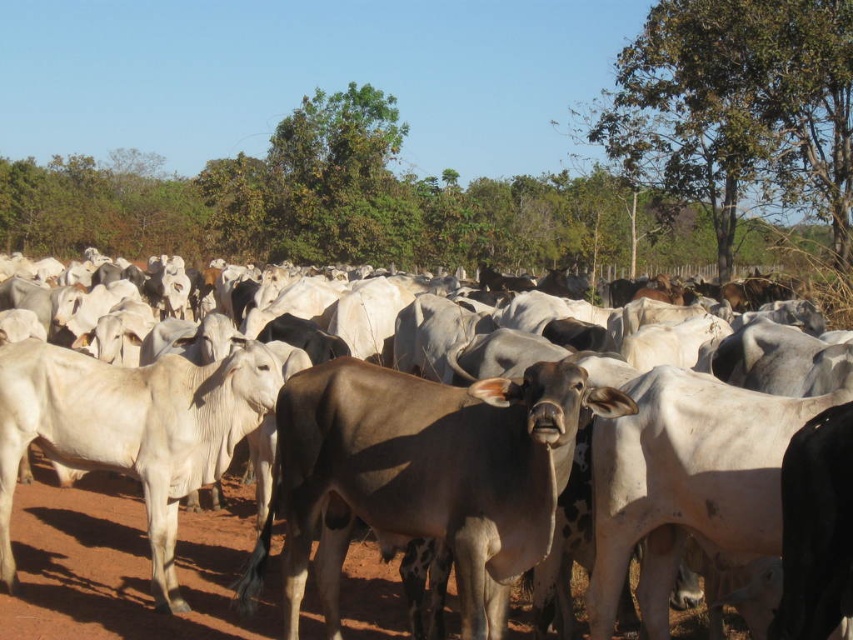
You are a farmer checking the herd and notice the green leafy tree at upper right and the white smooth cows at center. Which object is closer to you?

The white smooth cows at center are closer to you because the green leafy tree at upper right is further away.

You are standing at the origin point in the middle of the cattle herd. You need to locate two specific points marked in the image. The first point is at coordinate point[285,404] and the second is at point[206,582]. Which of these two points is closer to you?

Point[285,404] is in front of point[206,582], so the first point is closer to you.

You are a farmer trying to locate your cow in the herd. The herd is spread out in a field with a clear blue sky and trees in the background. Where is the brown smooth cow at center positioned relative to the herd?

The brown smooth cow at center is located at point [421,476], which places it centrally within the herd.